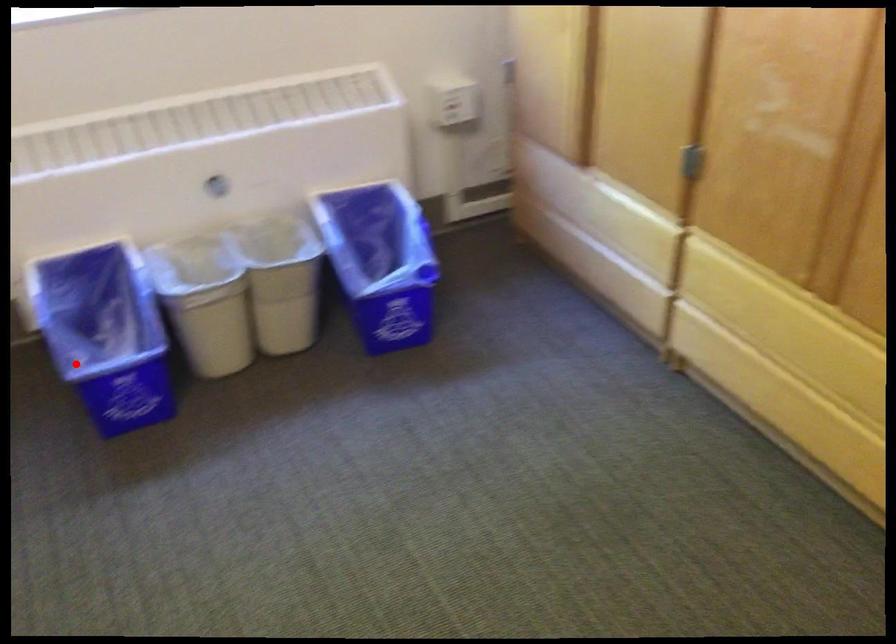
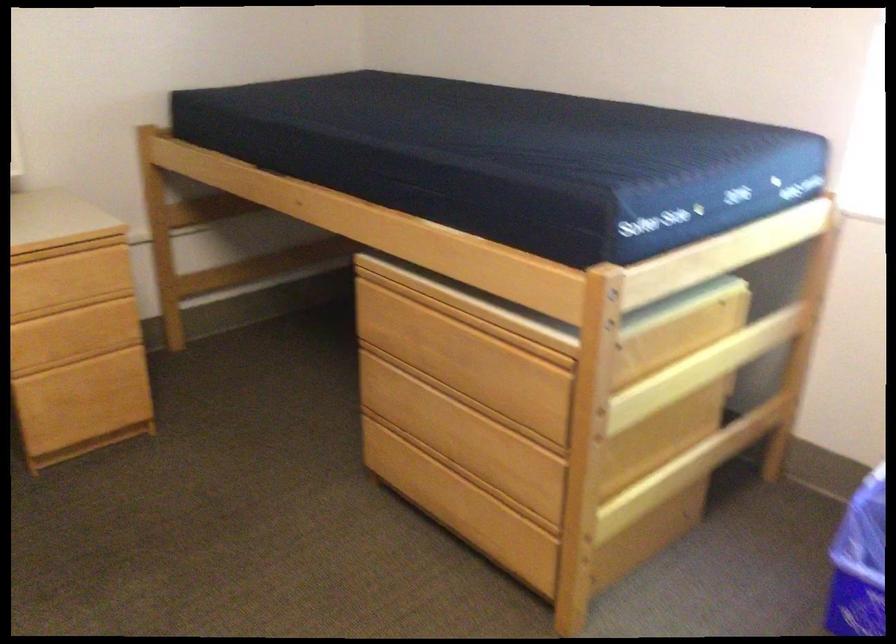
Find the pixel in the second image that matches the highlighted location in the first image.

(858, 563)